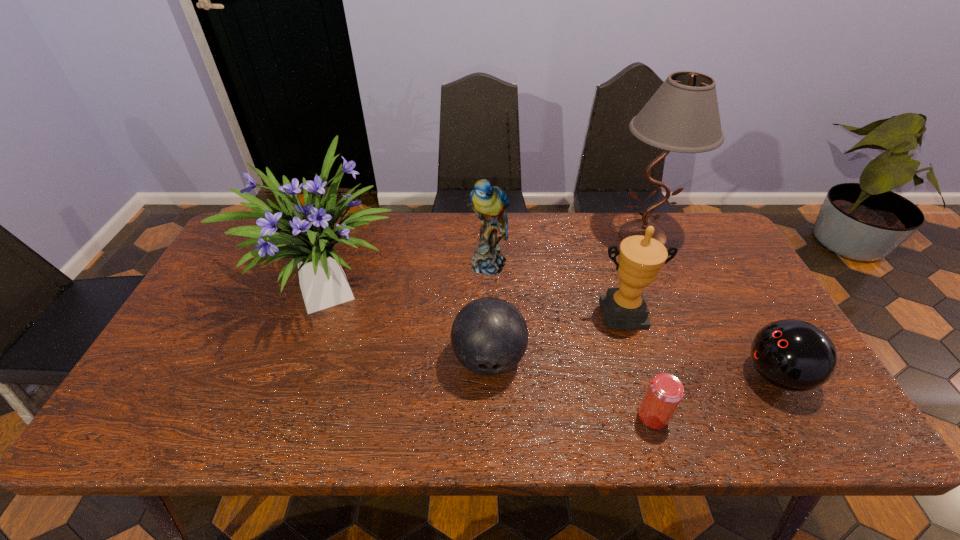
The width and height of the screenshot is (960, 540). I want to click on beer can at the near edge, so click(665, 392).

The image size is (960, 540). Find the location of `table lamp that is positioned at the right edge`. table lamp that is positioned at the right edge is located at coordinates (682, 116).

Identify the location of bowling ball that is at the right edge. (794, 355).

The width and height of the screenshot is (960, 540). In order to click on object that is positioned at the far right corner in this screenshot , I will do `click(682, 116)`.

This screenshot has width=960, height=540. What are the coordinates of `object situated at the near right corner` in the screenshot? It's located at (794, 355).

At what (x,y) coordinates should I click in order to perform the action: click on free region at the far edge of the desktop. Please return your answer as a coordinate pair (x, y). The height and width of the screenshot is (540, 960). Looking at the image, I should click on (344, 254).

The height and width of the screenshot is (540, 960). I want to click on free space at the left edge of the desktop, so 228,353.

Identify the location of blank space at the right edge. This screenshot has height=540, width=960. (732, 312).

Locate an element on the screen. free location at the near left corner is located at coordinates (158, 414).

The image size is (960, 540). Find the location of `vacant space at the far right corner of the desktop`. vacant space at the far right corner of the desktop is located at coordinates (686, 237).